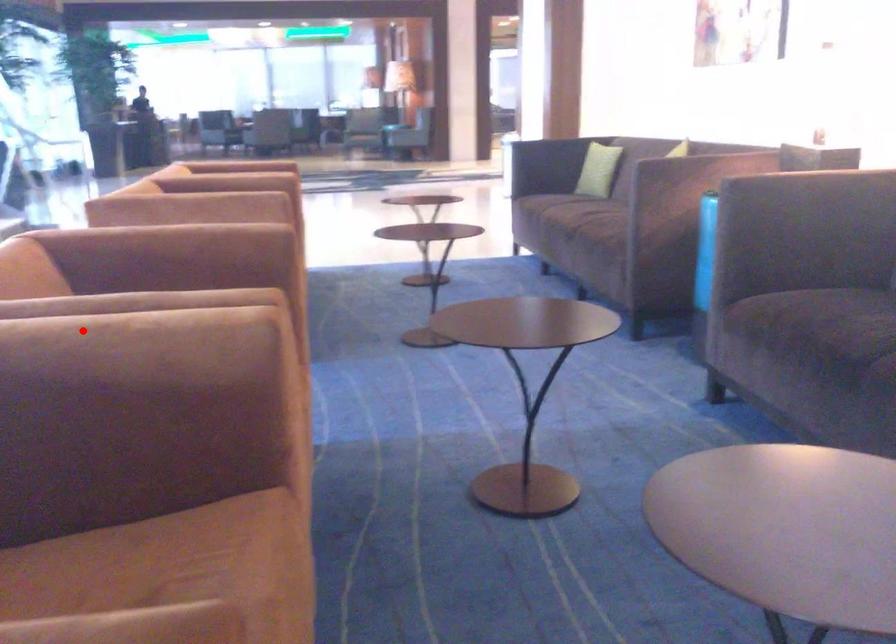
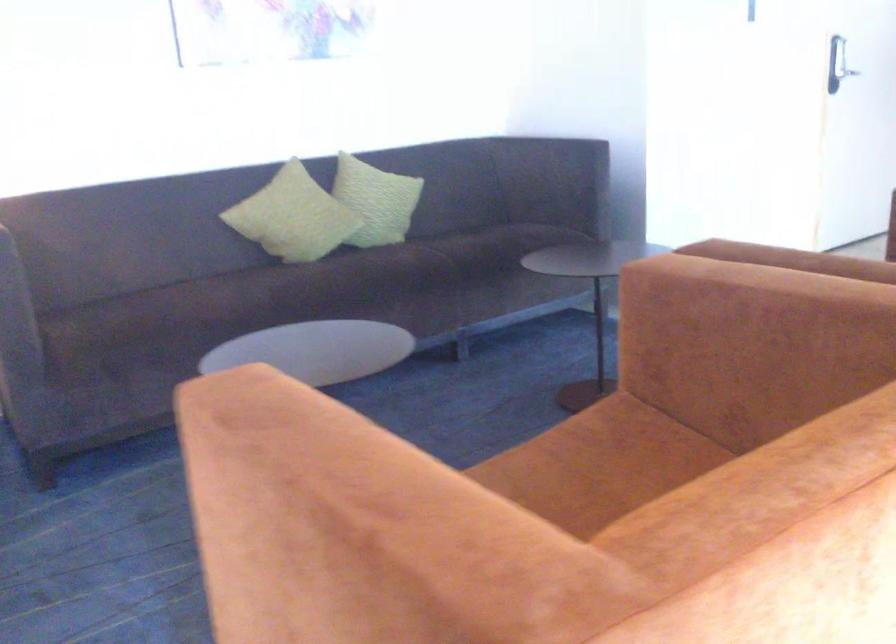
Where in the second image is the point corresponding to the highlighted location from the first image?

(782, 267)